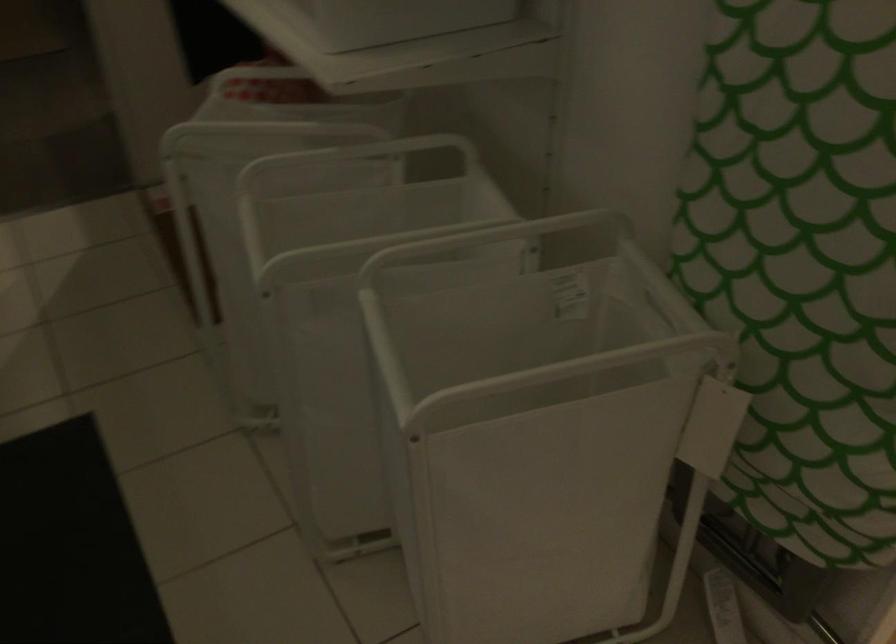
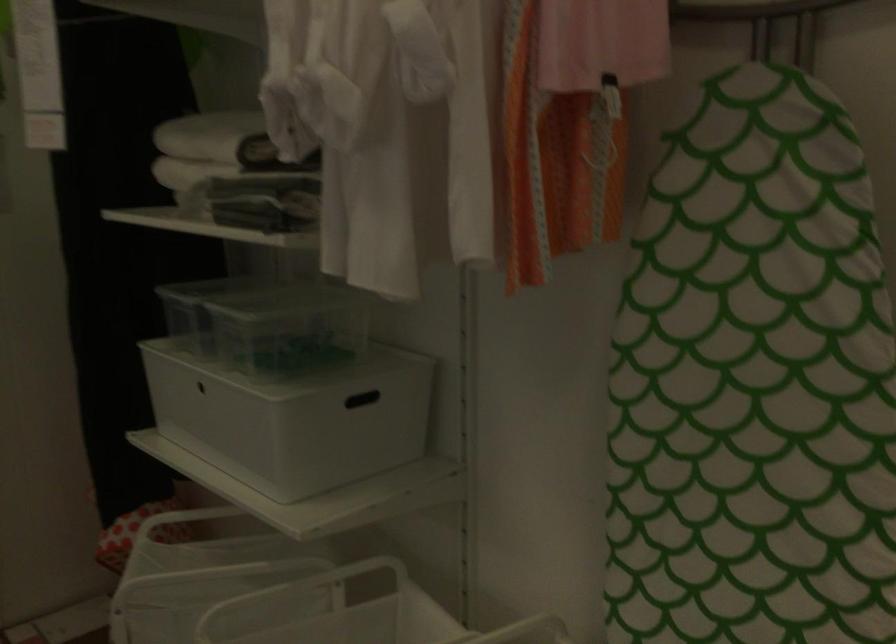
In the second image, find the point that corresponds to (252,79) in the first image.

(179, 525)